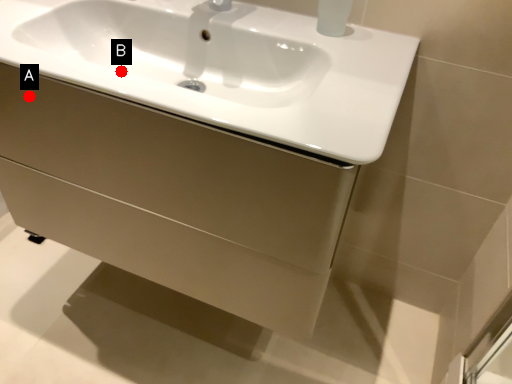
Question: Two points are circled on the image, labeled by A and B beside each circle. Which point is further to the camera?

Choices:
 (A) A is further
 (B) B is further

Answer: (A)